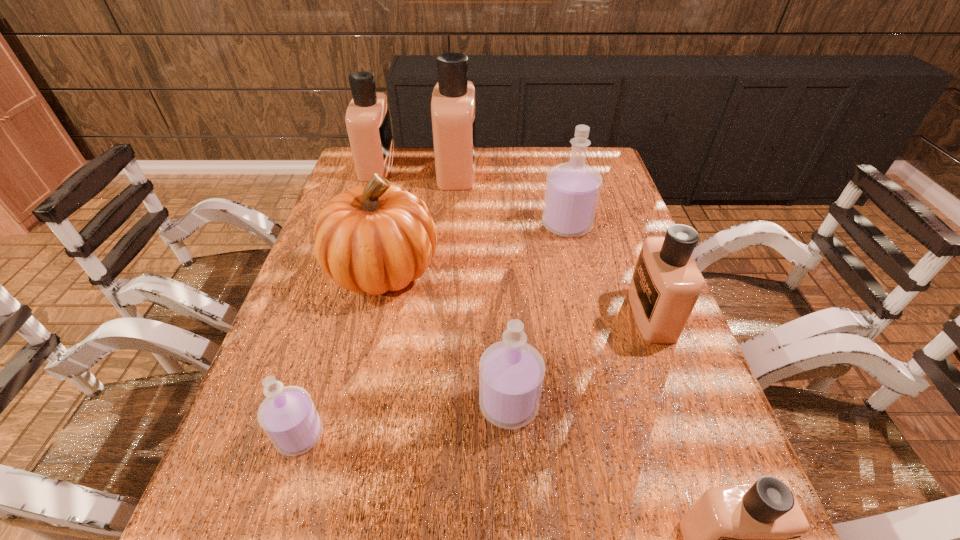
I want to click on the fifth perfume from right to left, so click(453, 116).

You are a GUI agent. You are given a task and a screenshot of the screen. Output one action in this format:
    pyautogui.click(x=<x>, y=<y>)
    Task: Click on the tallest object
    
    Given the screenshot: What is the action you would take?
    pyautogui.click(x=453, y=116)

You are a GUI agent. You are given a task and a screenshot of the screen. Output one action in this format:
    pyautogui.click(x=<x>, y=<y>)
    Task: Click on the leftmost beige perfume
    The height and width of the screenshot is (540, 960).
    Given the screenshot: What is the action you would take?
    pyautogui.click(x=367, y=118)

Locate an element on the screen. The height and width of the screenshot is (540, 960). the rightmost purple perfume is located at coordinates (572, 191).

In order to click on the fifth nearest perfume in this screenshot , I will do `click(572, 191)`.

Locate an element on the screen. pumpkin is located at coordinates (380, 237).

Where is `the fourth object from right to left`? the fourth object from right to left is located at coordinates (511, 372).

At what (x,y) coordinates should I click in order to perform the action: click on the fourth perfume from right to left. Please return your answer as a coordinate pair (x, y). The height and width of the screenshot is (540, 960). Looking at the image, I should click on (511, 372).

At what (x,y) coordinates should I click in order to perform the action: click on the third farthest beige perfume. Please return your answer as a coordinate pair (x, y). The height and width of the screenshot is (540, 960). Looking at the image, I should click on click(666, 284).

Where is `the fourth farthest perfume`? the fourth farthest perfume is located at coordinates (666, 284).